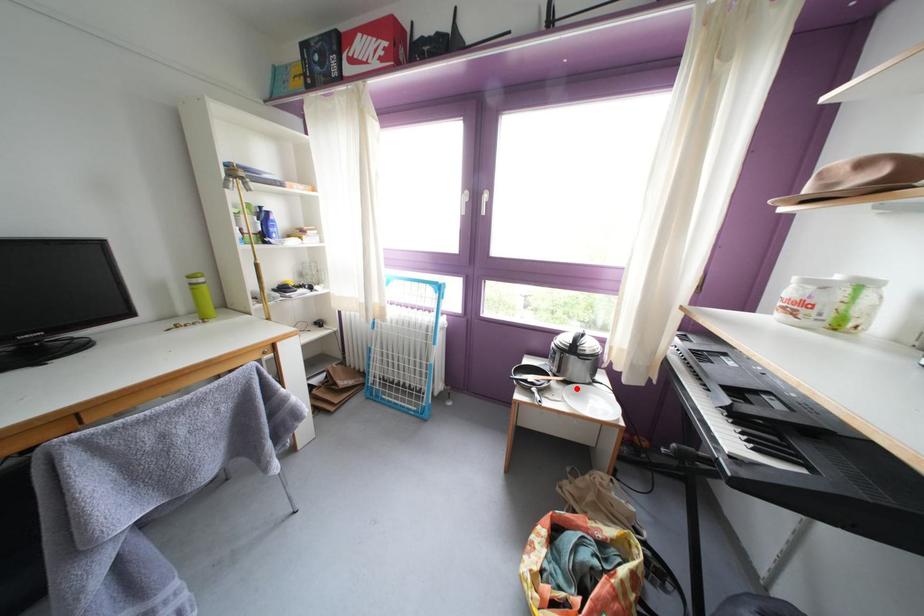
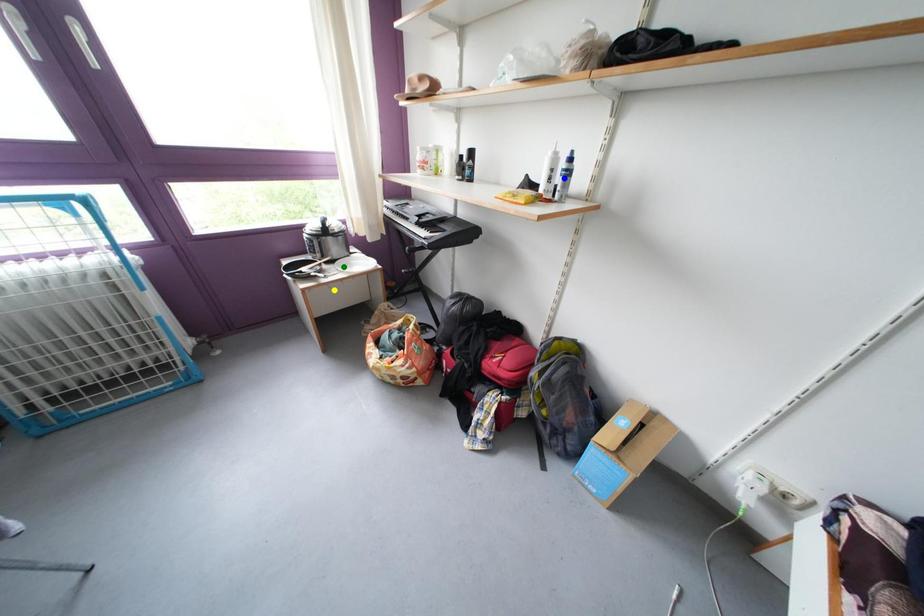
Question: I am providing you with two images of the same scene from different viewpoints. A red point is marked on the first image. You are given multiple points on the second image. Which mark in image 2 goes with the point in image 1?

Choices:
 (A) yellow point
 (B) blue point
 (C) green point

Answer: (C)